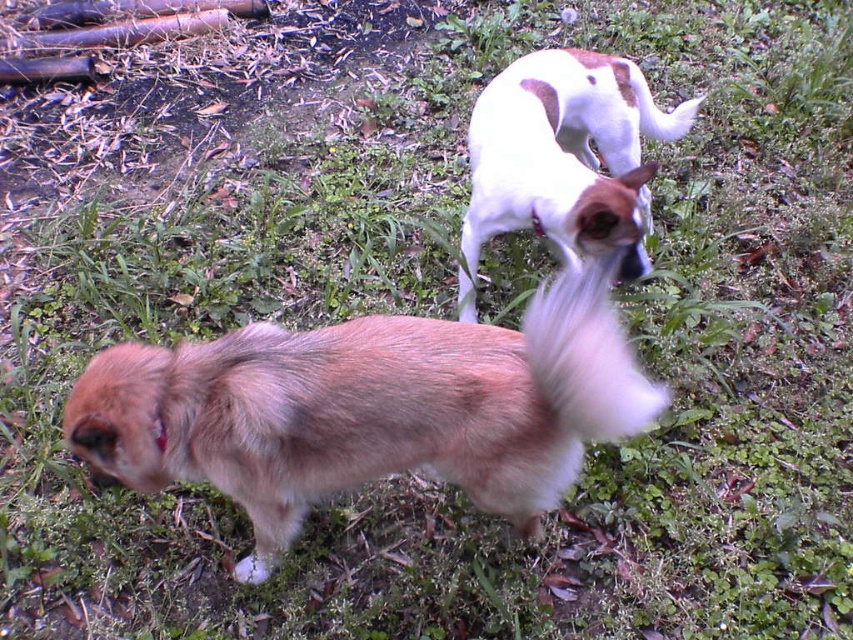
Can you confirm if white smooth dog at upper right is positioned below white fluffy tail at center?

No, white smooth dog at upper right is not below white fluffy tail at center.

Can you confirm if white smooth dog at upper right is wider than white fluffy tail at center?

Yes, white smooth dog at upper right is wider than white fluffy tail at center.

The image size is (853, 640). What do you see at coordinates (563, 157) in the screenshot? I see `white smooth dog at upper right` at bounding box center [563, 157].

Identify the location of white smooth dog at upper right. This screenshot has width=853, height=640. (563, 157).

Who is more distant from viewer, (268, 484) or (633, 74)?

The point (633, 74) is more distant.

Does point (274, 472) come in front of point (683, 129)?

Yes.

Measure the distance between light brown fur dog at center and camera.

light brown fur dog at center is 1.22 meters from camera.

Identify the location of light brown fur dog at center. (370, 408).

Between light brown fur dog at center and white fluffy tail at center, which one appears on the left side from the viewer's perspective?

Positioned to the left is light brown fur dog at center.

Is light brown fur dog at center in front of white fluffy tail at center?

That is False.

What do you see at coordinates (370, 408) in the screenshot? This screenshot has width=853, height=640. I see `light brown fur dog at center` at bounding box center [370, 408].

Find the location of a particular element. light brown fur dog at center is located at coordinates (370, 408).